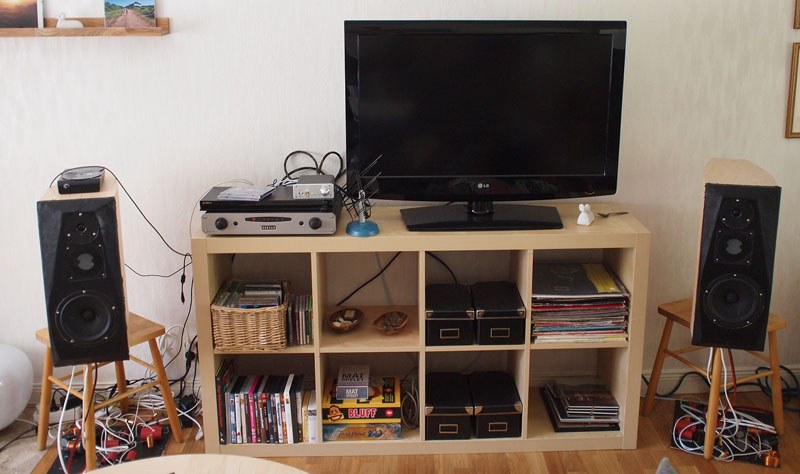
Locate an element on the screen. shelf is located at coordinates (98, 35).